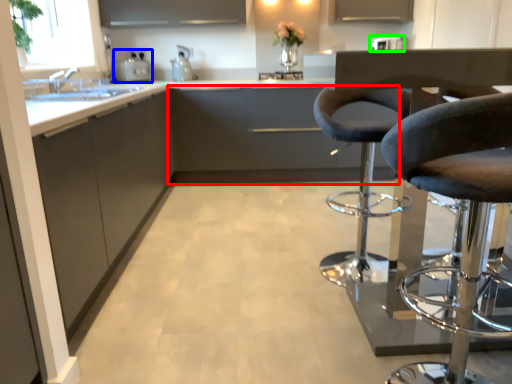
Question: Which is nearer to the cabinetry (highlighted by a red box)? appliance (highlighted by a blue box) or appliance (highlighted by a green box).

Choices:
 (A) appliance
 (B) appliance

Answer: (A)